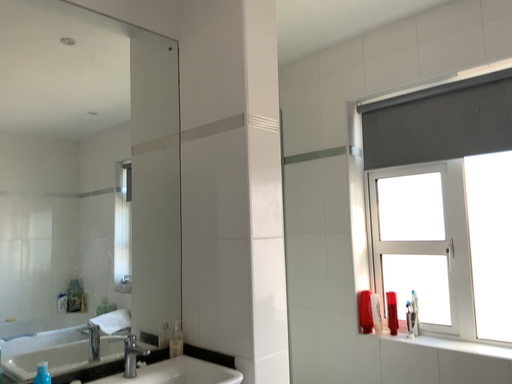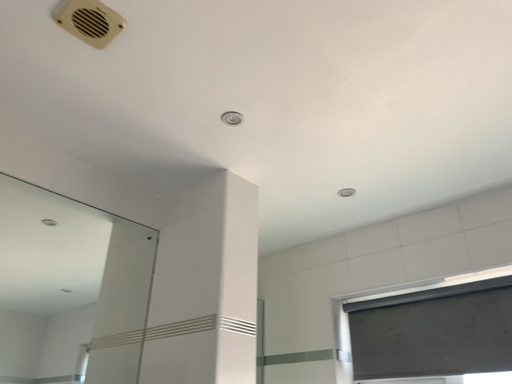
Question: Which way did the camera rotate in the video?

Choices:
 (A) rotated upward
 (B) rotated downward

Answer: (A)